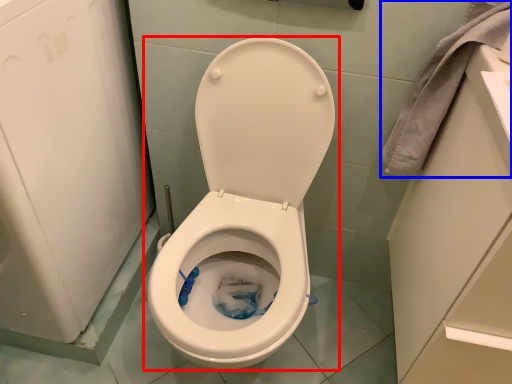
Question: Which object appears closest to the camera in this image, toilet (highlighted by a red box) or material (highlighted by a blue box)?

Choices:
 (A) toilet
 (B) material

Answer: (A)